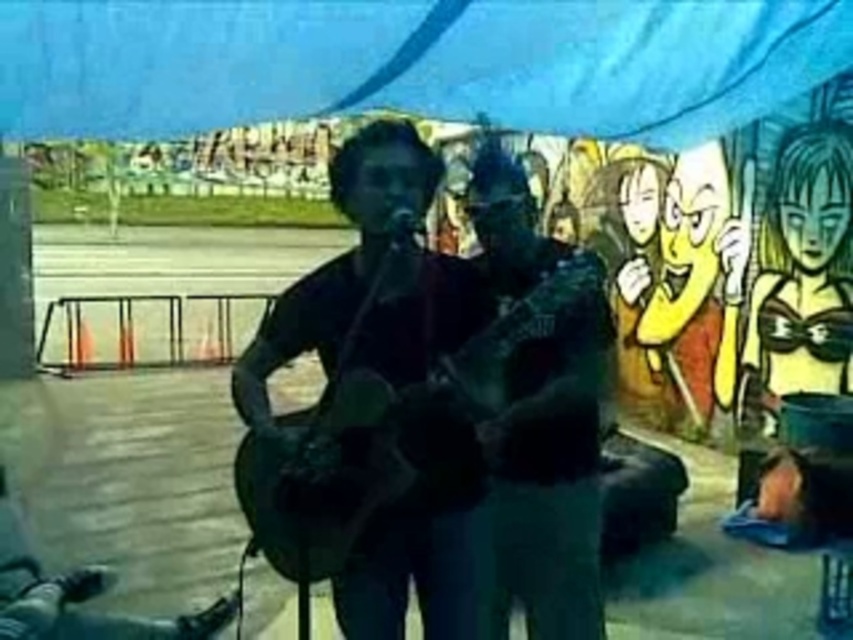
Does wooden acoustic guitar at center appear on the right side of dark green fabric guitar at center?

Incorrect, wooden acoustic guitar at center is not on the right side of dark green fabric guitar at center.

Does point (563, 244) lie in front of point (566, 588)?

No.

Image resolution: width=853 pixels, height=640 pixels. I want to click on wooden acoustic guitar at center, so click(427, 396).